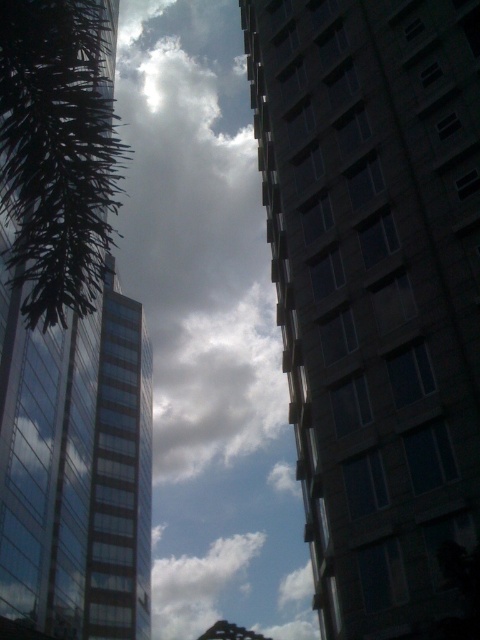
You are standing between two buildings and see a point at coordinates (58, 150). What object does this point correspond to?

The point at coordinates (58, 150) corresponds to the green leafy palm tree at left.

You are standing between two buildings and looking up. You see the glassy reflective tower at left and the white fluffy cloud at center. Which object is positioned more to the right from your perspective?

The glassy reflective tower at left is positioned to the right of the white fluffy cloud at center, so the glassy reflective tower at left is more to the right.

You are a drone operator trying to capture a photo of the dark glass building at right and the white fluffy cloud at center. The drone can only fly up to 500 feet. Can the drone safely capture both objects in the same shot without exceeding its maximum flight distance?

The dark glass building at right is 611.75 feet away from the white fluffy cloud at center, which exceeds the drone operator maximum flight distance of 500 feet. Therefore, the drone cannot safely capture both objects in the same shot without exceeding its limit.